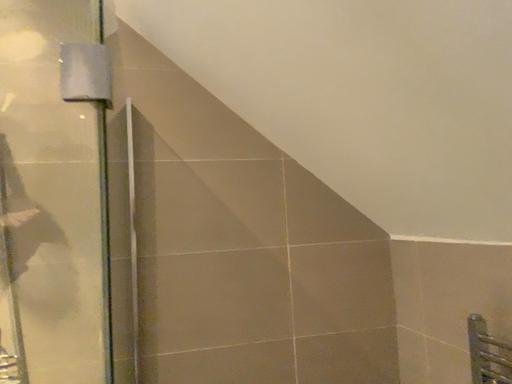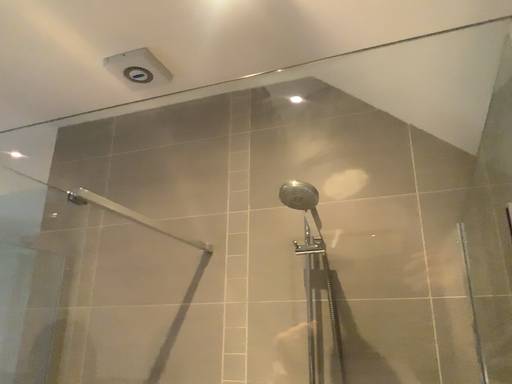
Question: How did the camera likely rotate when shooting the video?

Choices:
 (A) rotated downward
 (B) rotated upward

Answer: (B)